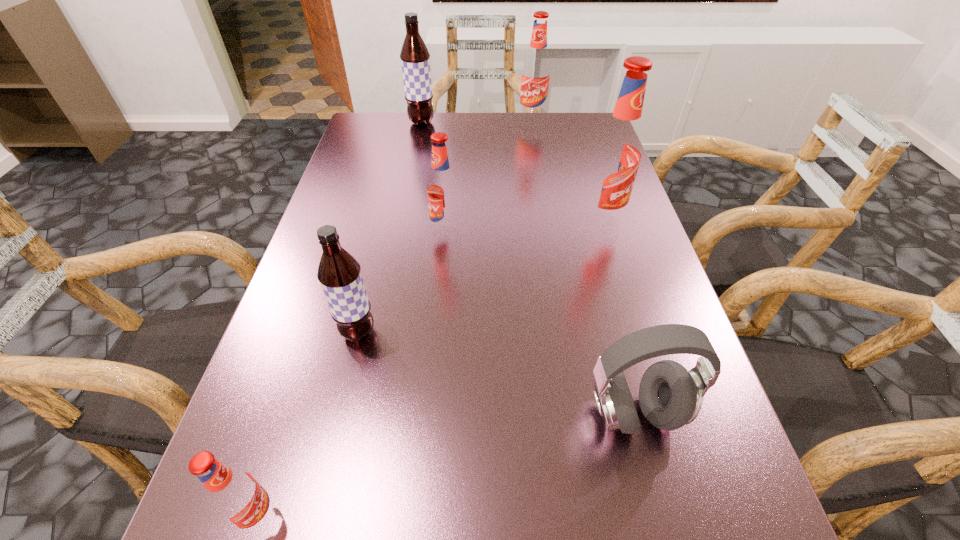
Select which red root beer is the third closest to the farther brown root beer. Please provide its 2D coordinates. Your answer should be formatted as a tuple, i.e. [(x, y)], where the tuple contains the x and y coordinates of a point satisfying the conditions above.

[(616, 154)]

The image size is (960, 540). In order to click on the fourth closest red root beer to the nearer brown root beer in this screenshot , I will do `click(535, 79)`.

This screenshot has height=540, width=960. Identify the location of the closest brown root beer to the second nearest object. (339, 273).